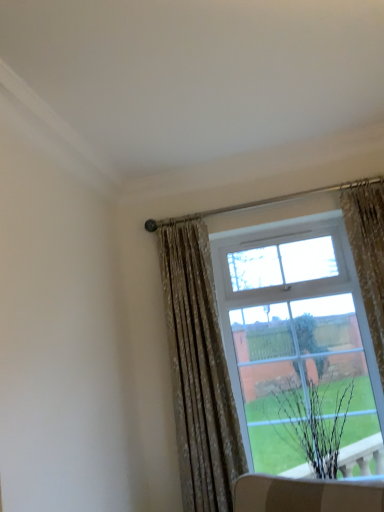
The image size is (384, 512). I want to click on black matte plant at lower right, so click(271, 438).

This screenshot has width=384, height=512. Find the location of `black matte plant at lower right`. black matte plant at lower right is located at coordinates (271, 438).

From the image's perspective, is floral fabric curtain at right, the 1th curtain in the right-to-left sequence, positioned above or below floral fabric curtain at upper right, which is the 2th curtain in right-to-left order?

Based on their image positions, floral fabric curtain at right, the 1th curtain in the right-to-left sequence, is located above floral fabric curtain at upper right, which is the 2th curtain in right-to-left order.

Where is `curtain on the left of floral fabric curtain at right, placed as the second curtain when sorted from left to right`? The image size is (384, 512). curtain on the left of floral fabric curtain at right, placed as the second curtain when sorted from left to right is located at coordinates (199, 371).

Who is bigger, floral fabric curtain at right, placed as the second curtain when sorted from left to right, or floral fabric curtain at upper right, which is the 2th curtain in right-to-left order?

floral fabric curtain at upper right, which is the 2th curtain in right-to-left order, is bigger.

Based on the photo, from a real-world perspective, is floral fabric curtain at right, the 1th curtain in the right-to-left sequence, located higher than floral fabric curtain at upper right, marked as the 1th curtain in a left-to-right arrangement?

Yes, from a real-world perspective, floral fabric curtain at right, the 1th curtain in the right-to-left sequence, is above floral fabric curtain at upper right, marked as the 1th curtain in a left-to-right arrangement.

How many degrees apart are the facing directions of floral fabric curtain at upper right, which is the 2th curtain in right-to-left order, and black matte plant at lower right?

floral fabric curtain at upper right, which is the 2th curtain in right-to-left order, and black matte plant at lower right are facing 0.000348 degrees away from each other.

Which object is wider, floral fabric curtain at upper right, which is the 2th curtain in right-to-left order, or black matte plant at lower right?

Wider between the two is black matte plant at lower right.

Considering the relative positions of floral fabric curtain at upper right, which is the 2th curtain in right-to-left order, and black matte plant at lower right in the image provided, is floral fabric curtain at upper right, which is the 2th curtain in right-to-left order, to the left of black matte plant at lower right from the viewer's perspective?

Indeed, floral fabric curtain at upper right, which is the 2th curtain in right-to-left order, is positioned on the left side of black matte plant at lower right.

From a real-world perspective, is floral fabric curtain at upper right, which is the 2th curtain in right-to-left order, over black matte plant at lower right?

Yes, from a real-world perspective, floral fabric curtain at upper right, which is the 2th curtain in right-to-left order, is over black matte plant at lower right

Can you confirm if black matte plant at lower right is thinner than floral fabric curtain at right, placed as the second curtain when sorted from left to right?

In fact, black matte plant at lower right might be wider than floral fabric curtain at right, placed as the second curtain when sorted from left to right.

Considering the points (273, 440) and (356, 266), which point is in front, point (273, 440) or point (356, 266)?

The point (356, 266) is more forward.

Choose the correct answer: Is black matte plant at lower right inside floral fabric curtain at right, the 1th curtain in the right-to-left sequence, or outside it?

black matte plant at lower right is not enclosed by floral fabric curtain at right, the 1th curtain in the right-to-left sequence.

Is black matte plant at lower right at the right side of floral fabric curtain at right, placed as the second curtain when sorted from left to right?

No, black matte plant at lower right is not to the right of floral fabric curtain at right, placed as the second curtain when sorted from left to right.

Which of these two, floral fabric curtain at right, the 1th curtain in the right-to-left sequence, or black matte plant at lower right, is bigger?

With larger size is black matte plant at lower right.

Considering the relative sizes of floral fabric curtain at right, the 1th curtain in the right-to-left sequence, and black matte plant at lower right in the image provided, is floral fabric curtain at right, the 1th curtain in the right-to-left sequence, shorter than black matte plant at lower right?

No, floral fabric curtain at right, the 1th curtain in the right-to-left sequence, is not shorter than black matte plant at lower right.

Considering the positions of objects floral fabric curtain at right, the 1th curtain in the right-to-left sequence, and black matte plant at lower right in the image provided, who is more to the left, floral fabric curtain at right, the 1th curtain in the right-to-left sequence, or black matte plant at lower right?

Positioned to the left is black matte plant at lower right.

From the image's perspective, is floral fabric curtain at right, placed as the second curtain when sorted from left to right, located beneath black matte plant at lower right?

Incorrect, from the image's perspective, floral fabric curtain at right, placed as the second curtain when sorted from left to right, is higher than black matte plant at lower right.

Is black matte plant at lower right looking in the opposite direction of floral fabric curtain at upper right, marked as the 1th curtain in a left-to-right arrangement?

black matte plant at lower right does not have its back to floral fabric curtain at upper right, marked as the 1th curtain in a left-to-right arrangement.

How distant is black matte plant at lower right from floral fabric curtain at upper right, marked as the 1th curtain in a left-to-right arrangement?

black matte plant at lower right and floral fabric curtain at upper right, marked as the 1th curtain in a left-to-right arrangement, are 17.00 inches apart from each other.

From a real-world perspective, relative to floral fabric curtain at upper right, which is the 2th curtain in right-to-left order, is black matte plant at lower right vertically above or below?

black matte plant at lower right is below floral fabric curtain at upper right, which is the 2th curtain in right-to-left order.

Considering the sizes of objects black matte plant at lower right and floral fabric curtain at upper right, which is the 2th curtain in right-to-left order, in the image provided, who is taller, black matte plant at lower right or floral fabric curtain at upper right, which is the 2th curtain in right-to-left order,?

Standing taller between the two is floral fabric curtain at upper right, which is the 2th curtain in right-to-left order.

Can you confirm if floral fabric curtain at upper right, marked as the 1th curtain in a left-to-right arrangement, is wider than floral fabric curtain at right, placed as the second curtain when sorted from left to right?

Indeed, floral fabric curtain at upper right, marked as the 1th curtain in a left-to-right arrangement, has a greater width compared to floral fabric curtain at right, placed as the second curtain when sorted from left to right.

From a real-world perspective, is floral fabric curtain at upper right, marked as the 1th curtain in a left-to-right arrangement, on floral fabric curtain at right, placed as the second curtain when sorted from left to right?

No, from a real-world perspective, floral fabric curtain at upper right, marked as the 1th curtain in a left-to-right arrangement, is not above floral fabric curtain at right, placed as the second curtain when sorted from left to right.

Could you measure the distance between floral fabric curtain at upper right, marked as the 1th curtain in a left-to-right arrangement, and floral fabric curtain at right, placed as the second curtain when sorted from left to right?

37.78 inches.

Consider the image. Between floral fabric curtain at upper right, which is the 2th curtain in right-to-left order, and floral fabric curtain at right, placed as the second curtain when sorted from left to right, which one appears on the left side from the viewer's perspective?

floral fabric curtain at upper right, which is the 2th curtain in right-to-left order, is more to the left.

Identify the location of curtain below the floral fabric curtain at right, the 1th curtain in the right-to-left sequence (from a real-world perspective). Image resolution: width=384 pixels, height=512 pixels. (199, 371).

Where is `the 1st curtain located above the black matte plant at lower right (from a real-world perspective)`? This screenshot has width=384, height=512. the 1st curtain located above the black matte plant at lower right (from a real-world perspective) is located at coordinates (199, 371).

From the image, which object appears to be nearer to floral fabric curtain at upper right, marked as the 1th curtain in a left-to-right arrangement, black matte plant at lower right or floral fabric curtain at right, placed as the second curtain when sorted from left to right?

black matte plant at lower right is positioned closer to the anchor floral fabric curtain at upper right, marked as the 1th curtain in a left-to-right arrangement.

When comparing their distances from black matte plant at lower right, does floral fabric curtain at upper right, marked as the 1th curtain in a left-to-right arrangement, or floral fabric curtain at right, placed as the second curtain when sorted from left to right, seem closer?

floral fabric curtain at upper right, marked as the 1th curtain in a left-to-right arrangement, is closer to black matte plant at lower right.

Looking at this image, based on their spatial positions, is floral fabric curtain at upper right, which is the 2th curtain in right-to-left order, or black matte plant at lower right closer to floral fabric curtain at right, the 1th curtain in the right-to-left sequence?

black matte plant at lower right lies closer to floral fabric curtain at right, the 1th curtain in the right-to-left sequence, than the other object.

Based on their spatial positions, is black matte plant at lower right or floral fabric curtain at upper right, which is the 2th curtain in right-to-left order, further from floral fabric curtain at right, placed as the second curtain when sorted from left to right?

floral fabric curtain at upper right, which is the 2th curtain in right-to-left order, lies further to floral fabric curtain at right, placed as the second curtain when sorted from left to right, than the other object.

When comparing their distances from black matte plant at lower right, does floral fabric curtain at right, the 1th curtain in the right-to-left sequence, or floral fabric curtain at upper right, marked as the 1th curtain in a left-to-right arrangement, seem further?

Based on the image, floral fabric curtain at right, the 1th curtain in the right-to-left sequence, appears to be further to black matte plant at lower right.

From the image, which object appears to be nearer to floral fabric curtain at upper right, which is the 2th curtain in right-to-left order, floral fabric curtain at right, the 1th curtain in the right-to-left sequence, or black matte plant at lower right?

black matte plant at lower right is closer to floral fabric curtain at upper right, which is the 2th curtain in right-to-left order.

Identify the location of plant between floral fabric curtain at upper right, which is the 2th curtain in right-to-left order, and floral fabric curtain at right, the 1th curtain in the right-to-left sequence. Image resolution: width=384 pixels, height=512 pixels. (271, 438).